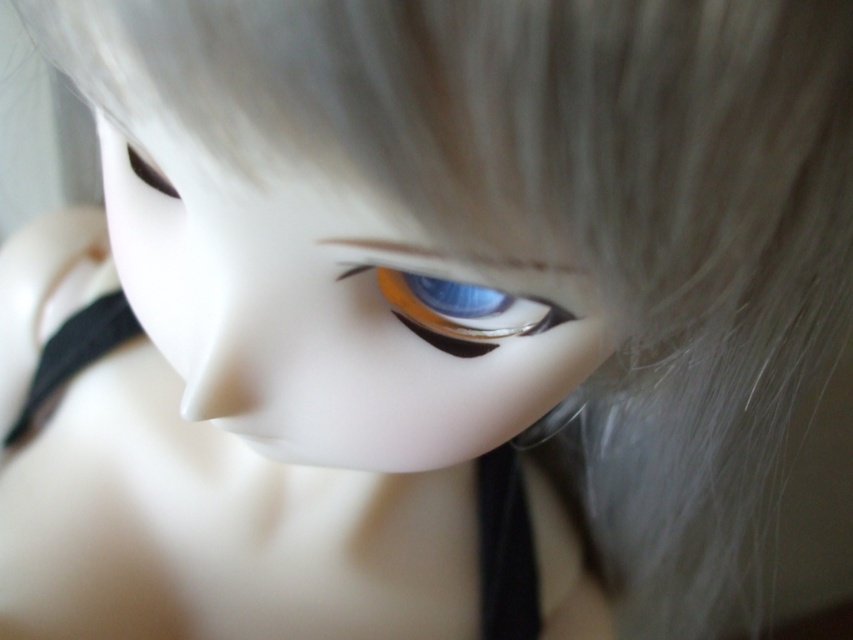
You are a photographer setting up a close shot of the doll. You need to ensure the satin white doll face at center and the black satin strap at lower left are both visible. Given their sizes, which object will occupy more space in the photo?

The satin white doll face at center will occupy more space in the photo because its width surpasses that of the black satin strap at lower left.

You are a photographer adjusting the lighting for a closeup shot of a doll. You notice a black satin strap at lower left located at point [73,356]. To ensure the strap is not in the main focus area, where should you position the camera focus? Please provide coordinates in the format x,y between 0 and 1.

The black satin strap at lower left is located at point [73,356]. To avoid it in the main focus area, position the camera focus away from this point. A safe coordinate could be 0.5, 0.5 to center on the doll.

You are a photographer adjusting your camera settings. You notice the blue glossy eye at center and the black matte strap at lower center in your frame. Which object is positioned to the right side of the other?

The black matte strap at lower center is positioned to the right of the blue glossy eye at center.